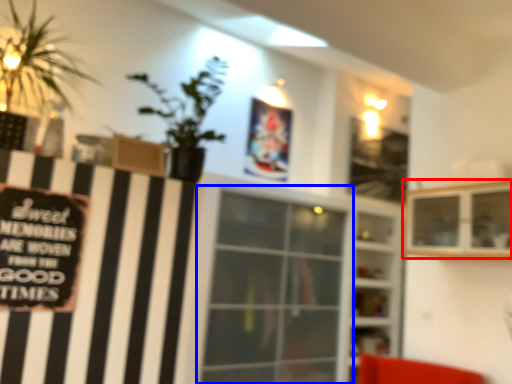
Question: Among these objects, which one is nearest to the camera, shelf (highlighted by a red box) or window (highlighted by a blue box)?

Choices:
 (A) shelf
 (B) window

Answer: (A)